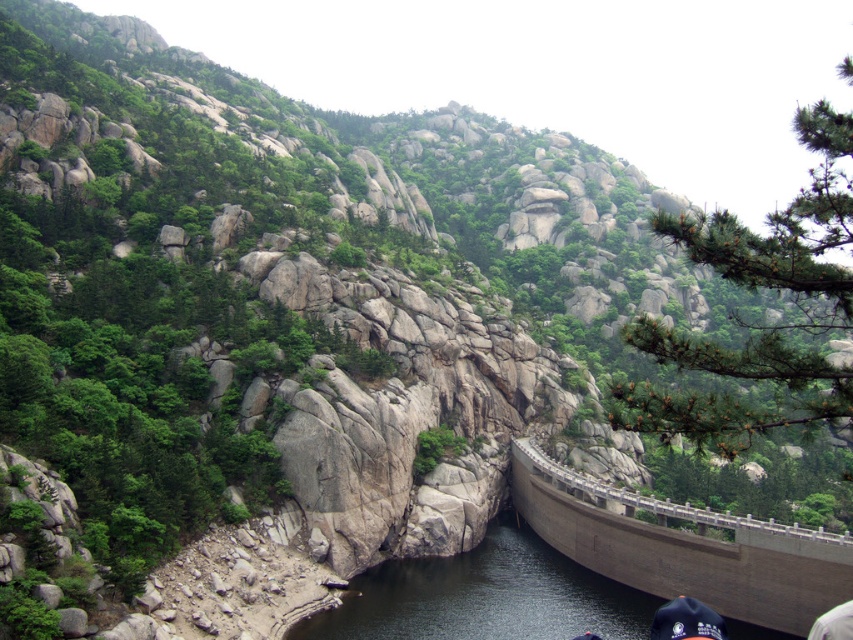
From the picture: You are a construction worker assessing the gray concrete dam at center and the dark gray concrete river at center. Which of these two structures has a narrower width?

Answer: The gray concrete dam at center has a narrower width than the dark gray concrete river at center.

Consider the image. Imagine you are standing at the point closer to the camera in this mountainous landscape. Which point are you at, point (729, 592) or point (410, 628)?

You are at point (729, 592) because it is further to the camera than point (410, 628), meaning it is closer to your position.

You are a civil engineer inspecting a mountainous area. You observe the gray concrete dam at center and the dark gray concrete river at center. Which structure is located above the other?

The gray concrete dam at center is positioned over the dark gray concrete river at center, so the dam is above the river.